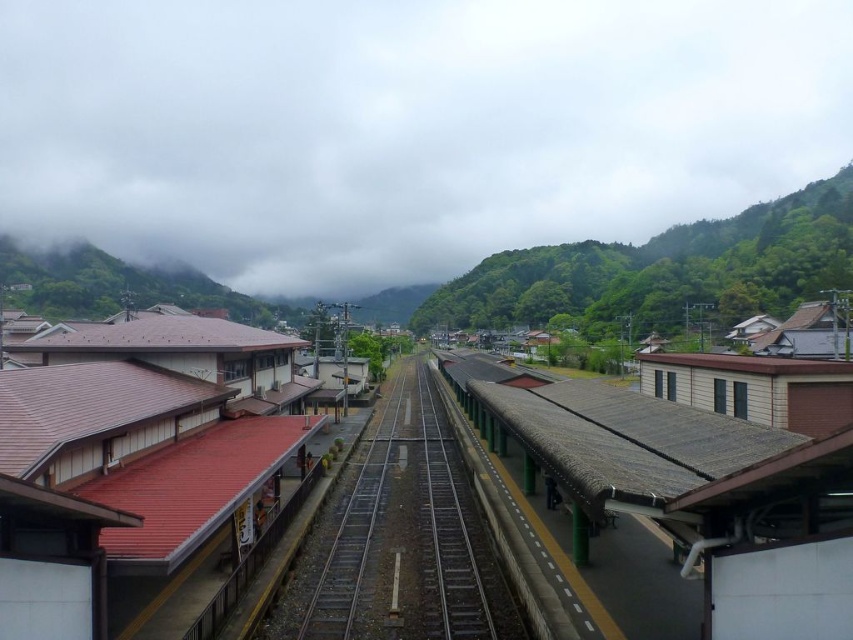
Consider the image. Does cloudy sky at upper center have a larger size compared to green corrugated metal train track at center?

Yes.

Between point (421, 186) and point (419, 477), which one is positioned behind?

Positioned behind is point (421, 186).

Find the location of a particular element. The image size is (853, 640). cloudy sky at upper center is located at coordinates 405,128.

Is the position of brown tiled roof at left more distant than that of green corrugated metal train track at center?

No, brown tiled roof at left is in front of green corrugated metal train track at center.

Does brown tiled roof at left appear under green corrugated metal train track at center?

Actually, brown tiled roof at left is above green corrugated metal train track at center.

Locate an element on the screen. This screenshot has width=853, height=640. brown tiled roof at left is located at coordinates (140, 472).

Between point (558, 474) and point (368, 451), which one is positioned behind?

Positioned behind is point (368, 451).

Does brown thatched roof platform at center appear on the left side of green corrugated metal train track at center?

Incorrect, brown thatched roof platform at center is not on the left side of green corrugated metal train track at center.

Describe the element at coordinates (693, 493) in the screenshot. I see `brown thatched roof platform at center` at that location.

Where is `brown thatched roof platform at center`? The width and height of the screenshot is (853, 640). brown thatched roof platform at center is located at coordinates (693, 493).